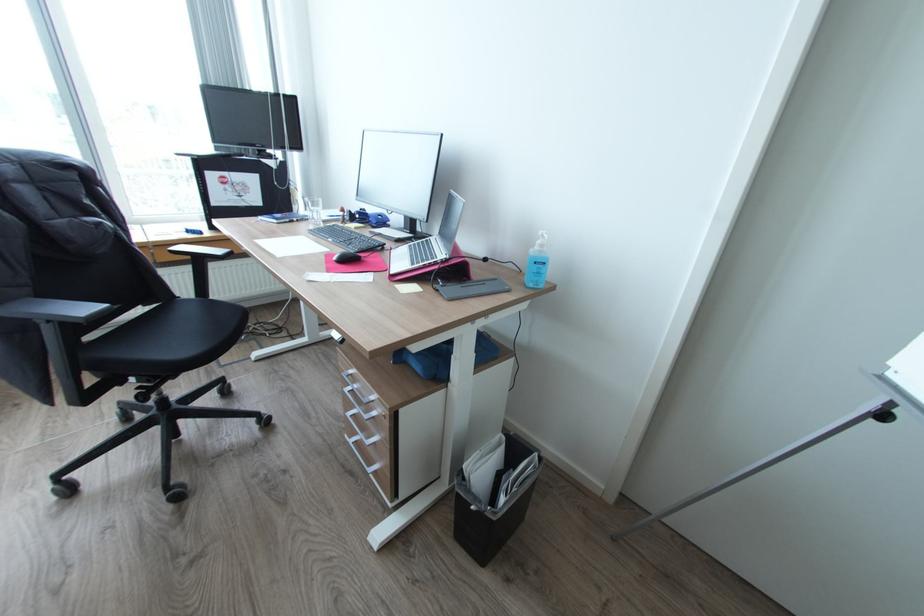
Where would you push the sanitizer pump top? Please return your answer as a coordinate pair (x, y).

(539, 252)